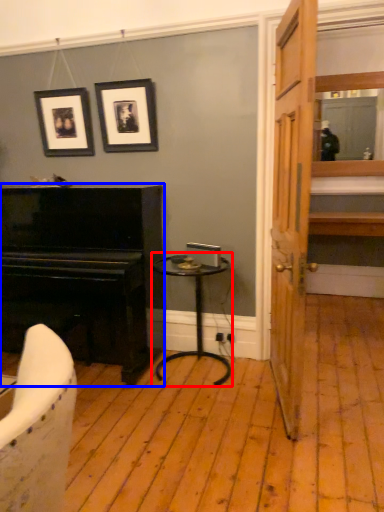
Question: Which of the following is the closest to the observer, table (highlighted by a red box) or piano (highlighted by a blue box)?

Choices:
 (A) table
 (B) piano

Answer: (B)